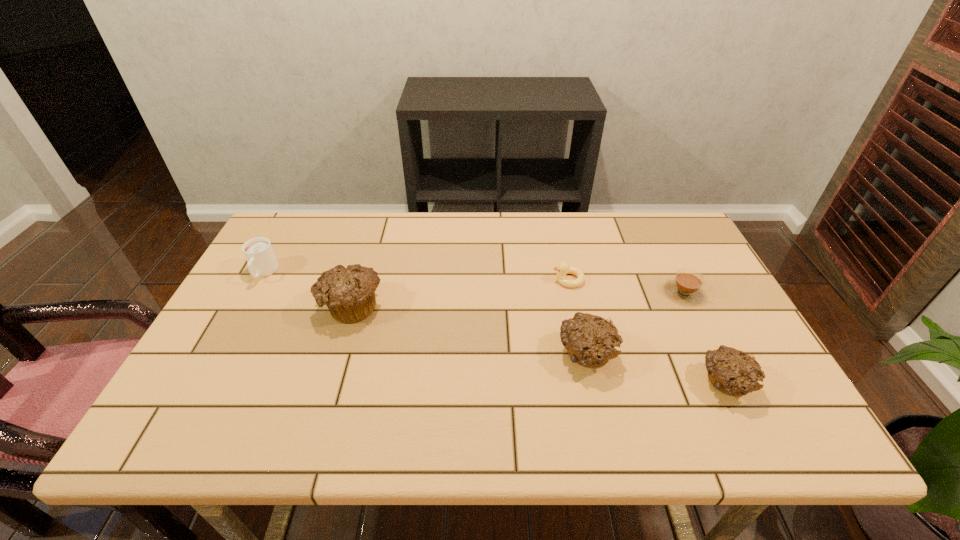
Find the location of `empty location between the second muffin from right to left and the shortest muffin`. empty location between the second muffin from right to left and the shortest muffin is located at coordinates (656, 369).

Where is `free space between the shorter cappuccino and the second shortest muffin`? The image size is (960, 540). free space between the shorter cappuccino and the second shortest muffin is located at coordinates (636, 323).

Locate an element on the screen. The width and height of the screenshot is (960, 540). empty location between the shortest muffin and the shorter cappuccino is located at coordinates (705, 338).

This screenshot has height=540, width=960. In order to click on free area in between the rightmost muffin and the leftmost muffin in this screenshot , I will do `click(538, 345)`.

Find the location of a particular element. vacant area that lies between the left cappuccino and the second muffin from left to right is located at coordinates (425, 314).

At what (x,y) coordinates should I click in order to perform the action: click on vacant space that's between the leftmost muffin and the rightmost muffin. Please return your answer as a coordinate pair (x, y). This screenshot has height=540, width=960. Looking at the image, I should click on (538, 345).

This screenshot has width=960, height=540. I want to click on object that stands as the fourth closest to the shorter cappuccino, so click(x=349, y=293).

Point out which object is positioned as the third nearest to the second muffin from left to right. Please provide its 2D coordinates. Your answer should be formatted as a tuple, i.e. [(x, y)], where the tuple contains the x and y coordinates of a point satisfying the conditions above.

[(686, 287)]

Where is `muffin that is the second closest to the second muffin from left to right`? Image resolution: width=960 pixels, height=540 pixels. muffin that is the second closest to the second muffin from left to right is located at coordinates (349, 293).

Identify the location of muffin that is the second closest one to the rightmost muffin. The width and height of the screenshot is (960, 540). (349, 293).